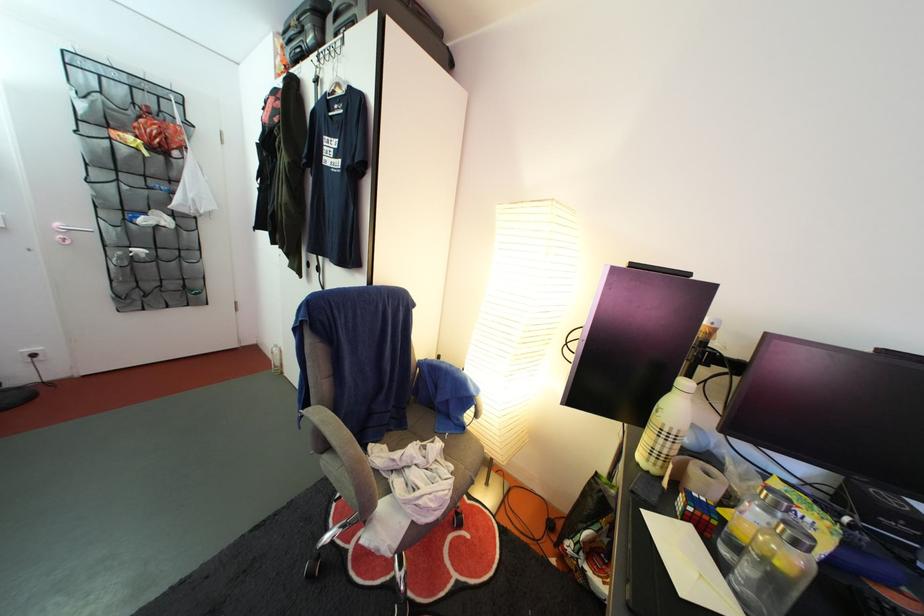
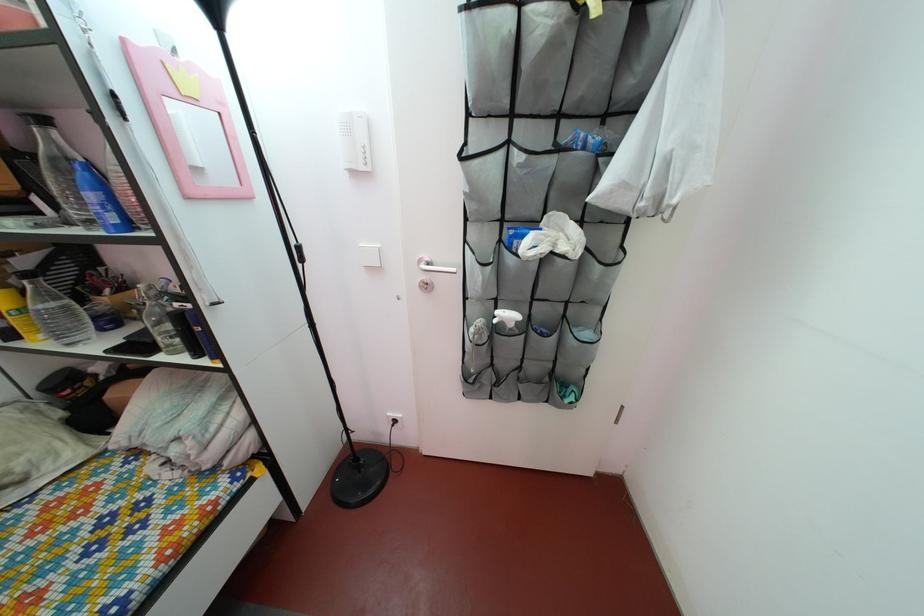
Locate, in the second image, the point that corresponds to (x=199, y=204) in the first image.

(675, 152)